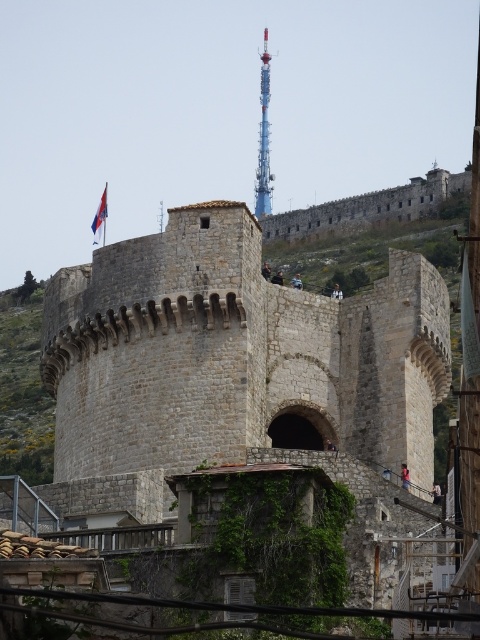
Based on the photo, which is more to the left, stone castle at center or blue metallic tower at center?

stone castle at center

Who is more forward, (415, 269) or (263, 84)?

Positioned in front is point (415, 269).

The height and width of the screenshot is (640, 480). I want to click on stone castle at center, so click(237, 372).

What do you see at coordinates (264, 140) in the screenshot? I see `blue metallic tower at center` at bounding box center [264, 140].

Is blue metallic tower at center thinner than red fabric flag at upper left?

Correct, blue metallic tower at center's width is less than red fabric flag at upper left's.

Is point (257, 154) more distant than point (97, 205)?

Yes, it is.

Locate an element on the screen. The image size is (480, 640). blue metallic tower at center is located at coordinates (264, 140).

Is point (338, 474) behind point (105, 204)?

No, it is in front of (105, 204).

Between stone castle at center and red fabric flag at upper left, which one appears on the right side from the viewer's perspective?

stone castle at center

Does point (60, 280) come in front of point (100, 236)?

Yes.

At what (x,y) coordinates should I click in order to perform the action: click on stone castle at center. Please return your answer as a coordinate pair (x, y). Image resolution: width=480 pixels, height=640 pixels. Looking at the image, I should click on (237, 372).